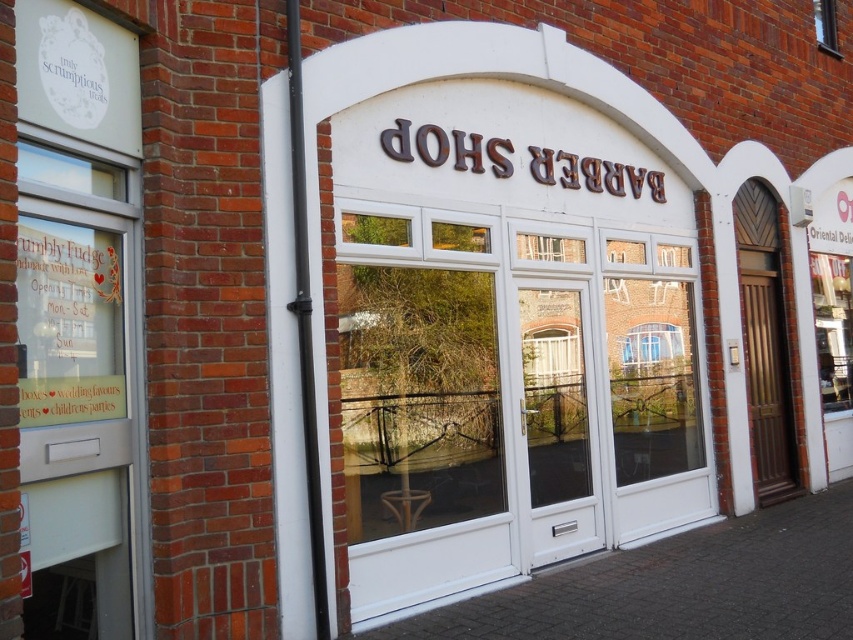
You are a customer entering the barber shop and need to locate the entrance. Based on the scene, which object is taller and would be more visible from a distance? Please choose between the brown wooden door at right and the transparent glass window at upper right.

The brown wooden door at right is taller than the transparent glass window at upper right, so it would be more visible from a distance.

You are standing in front of the building and want to enter the barber shop. The door you need to use is the brown wooden door at right. There is a specific point marked at coordinates point (766, 371) on the door. Can you reach this point on the door without moving closer than 1 meter from the door?

The point (766, 371) is on the brown wooden door at right. Since you are standing 1 meter away from the door, you can reach the point on the door by extending your arm or using a tool, as the distance is within a typical human reach range.